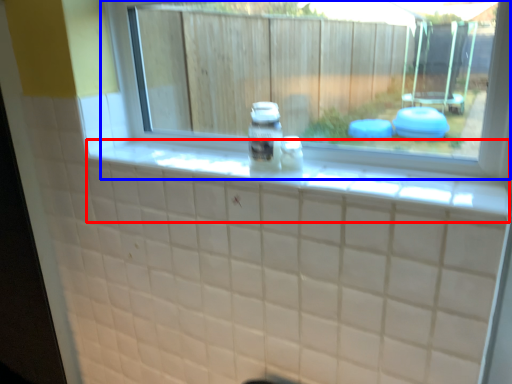
Question: Among these objects, which one is farthest to the camera, ledge (highlighted by a red box) or window (highlighted by a blue box)?

Choices:
 (A) ledge
 (B) window

Answer: (B)